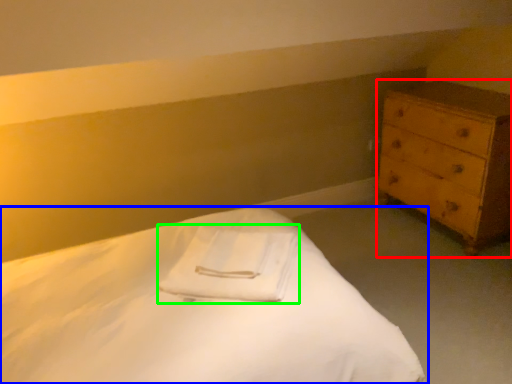
Question: Estimate the real-world distances between objects in this image. Which object is closer to chest of drawers (highlighted by a red box), bed (highlighted by a blue box) or cloth (highlighted by a green box)?

Choices:
 (A) bed
 (B) cloth

Answer: (B)